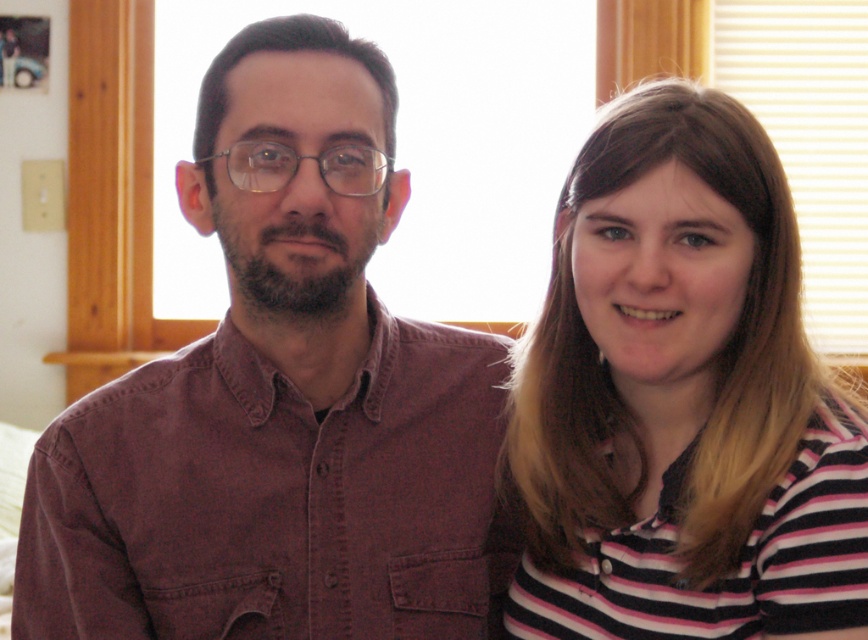
You are a photographer adjusting the focus on your camera. You need to focus on both the point at (179,433) and the point at (702,592). Which point should you focus on first to ensure the closest object is sharp?

You should focus on point (179,433) first because it is closer to the viewer than point (702,592), ensuring the closest object is sharp before adjusting for the farther one.

You are a photographer adjusting the camera focus. You need to ensure both the matte brown shirt at left and striped cotton shirt at right are in focus. The camera can focus on objects within a 25 cm range. Can both shirts be in focus at the same time?

The matte brown shirt at left and striped cotton shirt at right are 28.18 centimeters apart. Since the distance between them exceeds the camera focus range of 25 cm, both shirts cannot be in focus simultaneously.